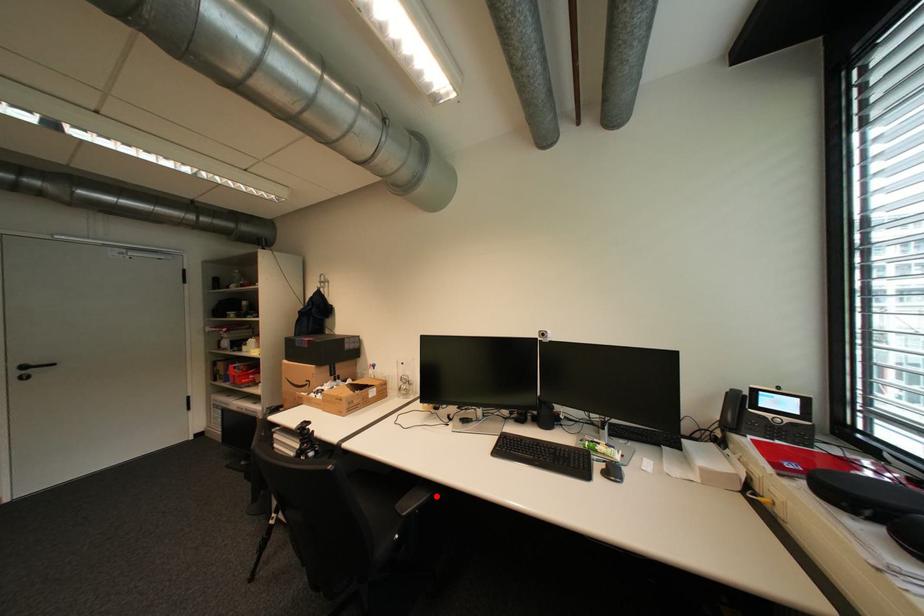
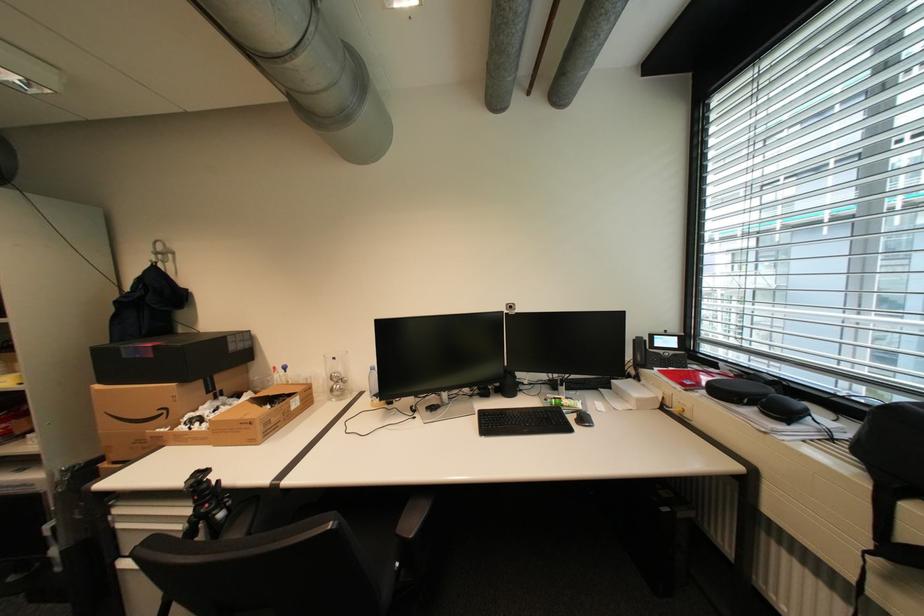
Where in the second image is the point corresponding to the highlighted location from the first image?

(439, 503)